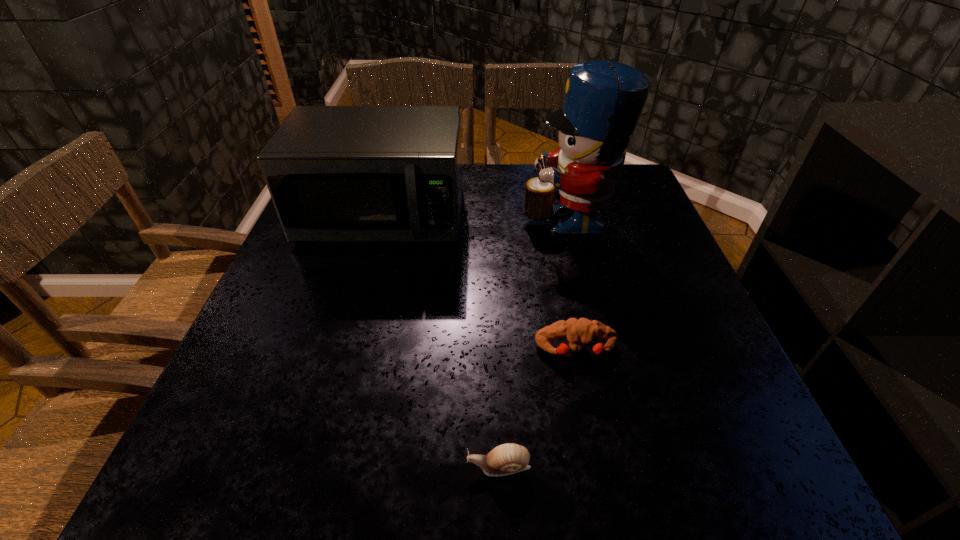
Locate an element on the screen. object that is at the far right corner is located at coordinates (603, 101).

Find the location of `vacant space at the far edge of the desktop`. vacant space at the far edge of the desktop is located at coordinates (468, 205).

Where is `free space at the near edge`? free space at the near edge is located at coordinates (523, 494).

Identify the location of free region at the left edge of the desktop. This screenshot has height=540, width=960. (266, 294).

This screenshot has height=540, width=960. I want to click on free region at the right edge, so click(x=673, y=281).

In the image, there is a desktop. What are the coordinates of `vacant region at the far right corner` in the screenshot? It's located at (634, 180).

Locate an element on the screen. The image size is (960, 540). vacant space at the near right corner of the desktop is located at coordinates (672, 449).

Locate an element on the screen. free spot between the nearest object and the tallest object is located at coordinates (533, 341).

The height and width of the screenshot is (540, 960). In order to click on vacant area that lies between the nutcracker and the third shortest object in this screenshot , I will do `click(474, 217)`.

You are a GUI agent. You are given a task and a screenshot of the screen. Output one action in this format:
    pyautogui.click(x=<x>, y=<y>)
    Task: Click on the free space between the third object from right to left and the puncher
    This screenshot has height=540, width=960.
    Given the screenshot: What is the action you would take?
    pyautogui.click(x=538, y=408)